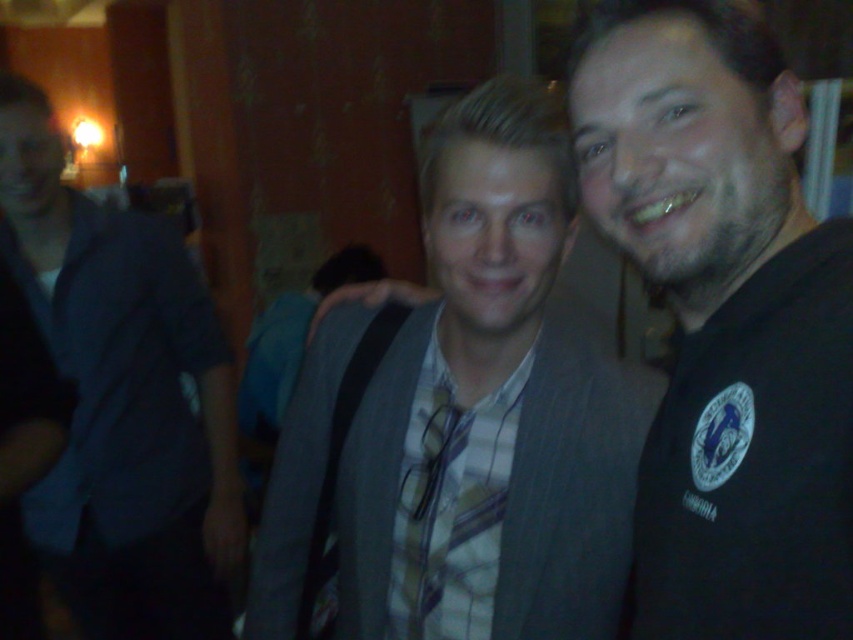
Measure the distance from matte gray suit at center to dark blue shirt at left.

They are 4.61 feet apart.

Is matte gray suit at center further to camera compared to dark blue shirt at left?

No, it is not.

Who is more distant from viewer, (x=799, y=365) or (x=99, y=320)?

The point (x=99, y=320) is more distant.

Locate an element on the screen. The width and height of the screenshot is (853, 640). matte gray suit at center is located at coordinates coord(724,320).

The image size is (853, 640). Identify the location of dark blue shirt at left. (122, 400).

Who is more forward, (41,163) or (422,524)?

Point (422,524) is more forward.

At what (x,y) coordinates should I click in order to perform the action: click on dark blue shirt at left. Please return your answer as a coordinate pair (x, y). The image size is (853, 640). Looking at the image, I should click on (122, 400).

Is point (740, 20) positioned after point (427, 419)?

No, (740, 20) is in front of (427, 419).

Can you confirm if matte gray suit at center is bigger than yellow plaid tie at center?

Correct, matte gray suit at center is larger in size than yellow plaid tie at center.

Does point (677, 88) come in front of point (415, 586)?

Yes, it is in front of point (415, 586).

Identify the location of matte gray suit at center. The height and width of the screenshot is (640, 853). (724, 320).